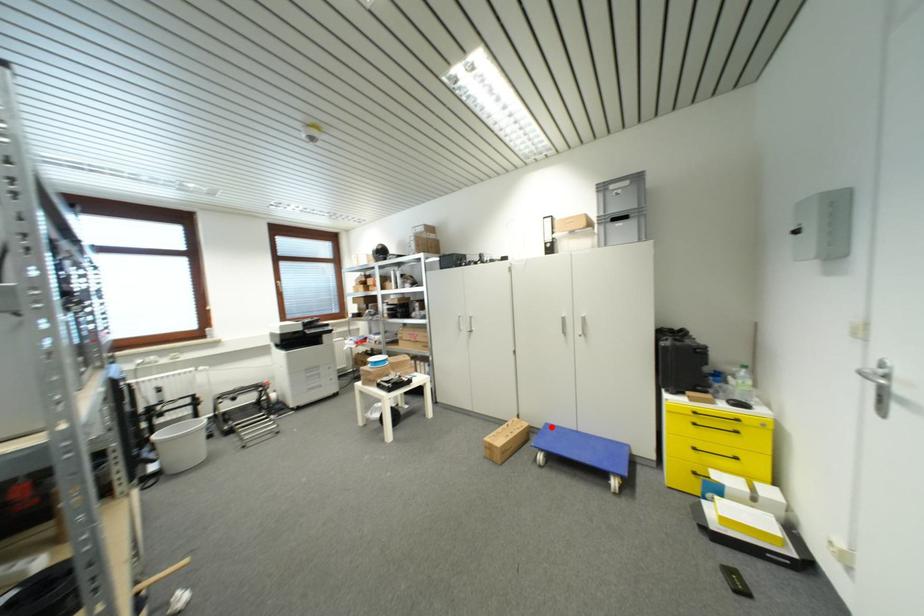
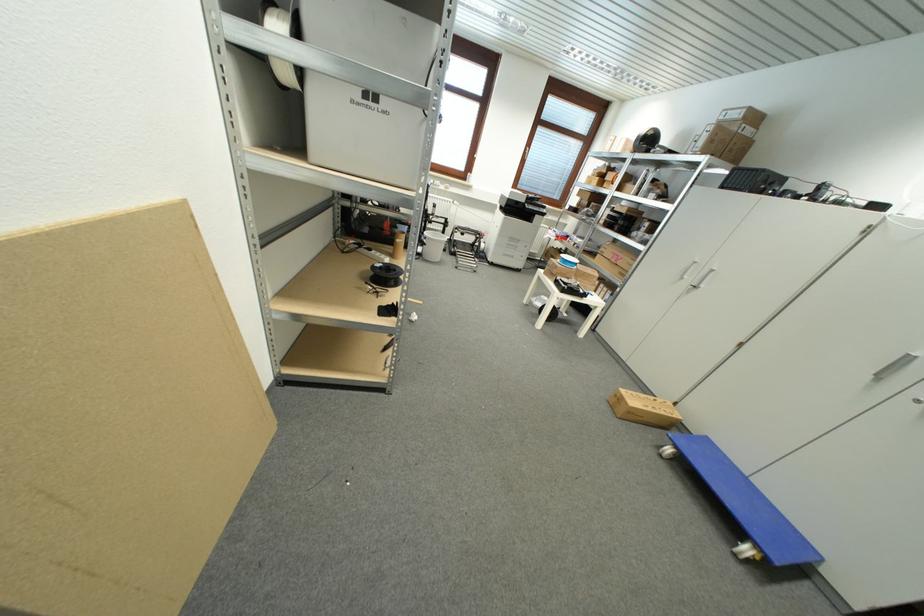
In the second image, find the point that corresponds to the highlighted location in the first image.

(711, 440)